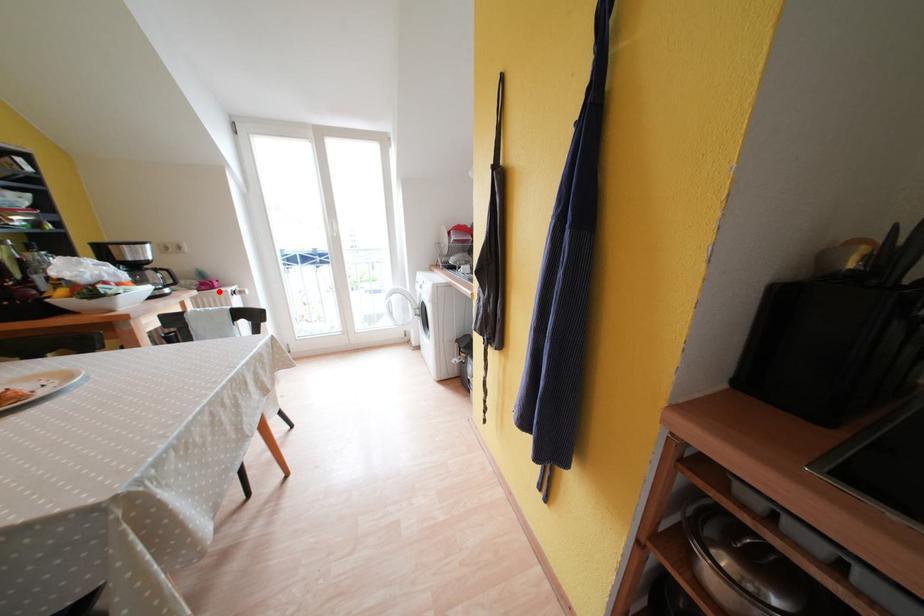
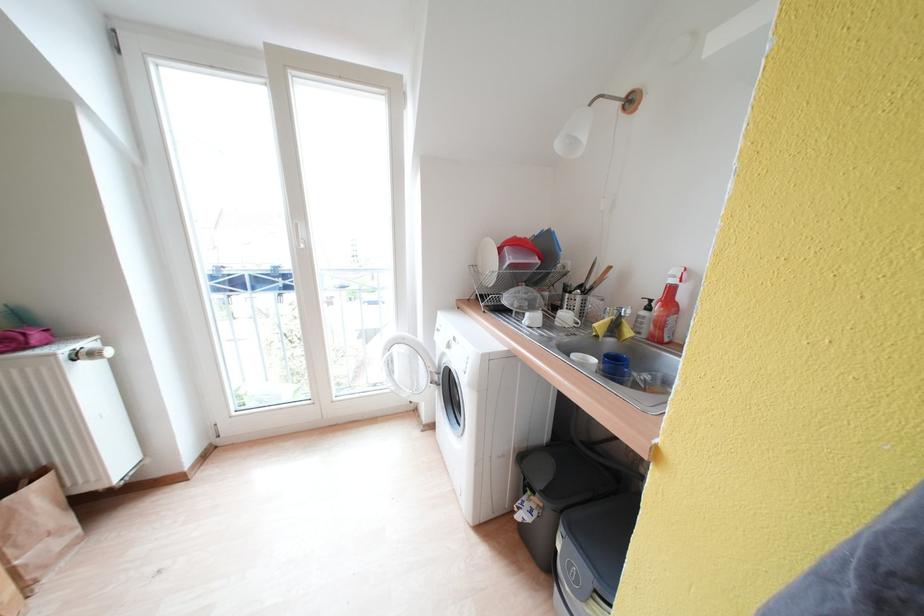
Find the pixel in the second image that matches the highlighted location in the first image.

(30, 351)